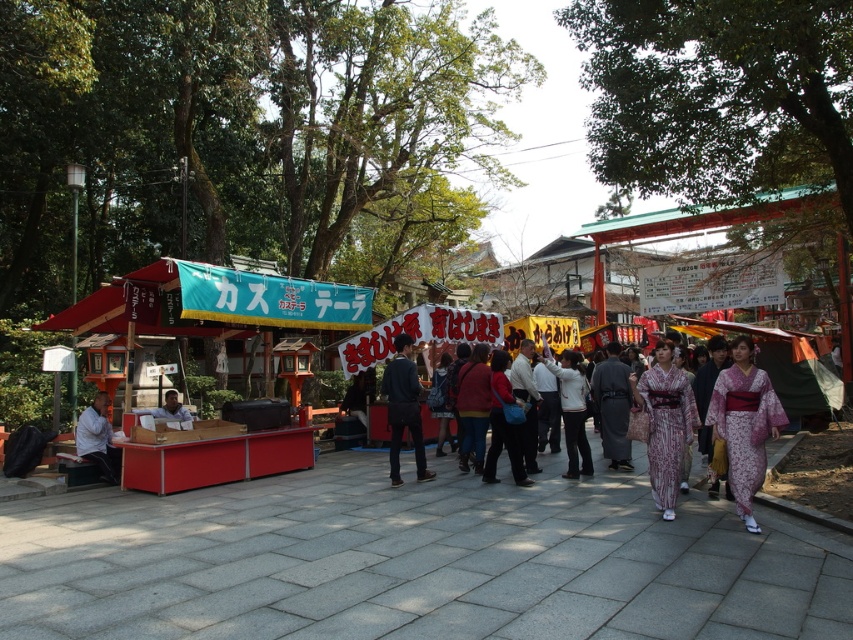
Question: Which is farther from the purple floral kimono at center?

Choices:
 (A) patterned silk kimono at center
 (B) dark gray fabric kimono at center
 (C) white matte jacket at center

Answer: (C)

Question: Considering the relative positions of purple floral kimono at center and white matte jacket at center in the image provided, where is purple floral kimono at center located with respect to white matte jacket at center?

Choices:
 (A) left
 (B) right

Answer: (B)

Question: Which of these objects is positioned farthest from the patterned silk kimono at center?

Choices:
 (A) matte white vendor at lower left
 (B) white matte jacket at center
 (C) dark blue fabric jacket at center
 (D) patterned kimono at center

Answer: (A)

Question: Based on their relative distances, which object is farther from the matte white vendor at lower left?

Choices:
 (A) purple floral kimono at center
 (B) dark blue fabric jacket at center
 (C) white matte jacket at center

Answer: (A)

Question: Can you confirm if white matte jacket at center is positioned to the right of matte white vendor at lower left?

Choices:
 (A) yes
 (B) no

Answer: (A)

Question: Is dark blue fabric jacket at center positioned behind matte white vendor at lower left?

Choices:
 (A) yes
 (B) no

Answer: (B)